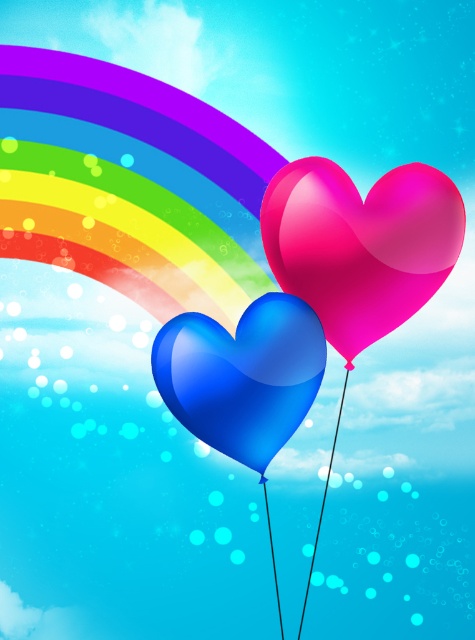
You are holding a measuring tape and need to determine which of the two balloons, the glossy pink heart at center or the glossy blue heart at center, has a greater width. Based on the scene, which one is wider?

The glossy pink heart at center has a greater width than the glossy blue heart at center according to the description.

You are holding a long stick and want to pop the glossy pink heart at center and the glossy blue heart at center. Which one should you aim for first if you want to pop the one that is higher up?

The glossy pink heart at center is above the glossy blue heart at center, so you should aim for the glossy pink heart at center first to pop the higher one.

You are an observer looking at the scene. There is a glossy pink heart at center. Where is it positioned in relation to the rainbow?

The glossy pink heart at center is located at point (361, 244), which is below the rainbow arching across the upper left portion of the sky.